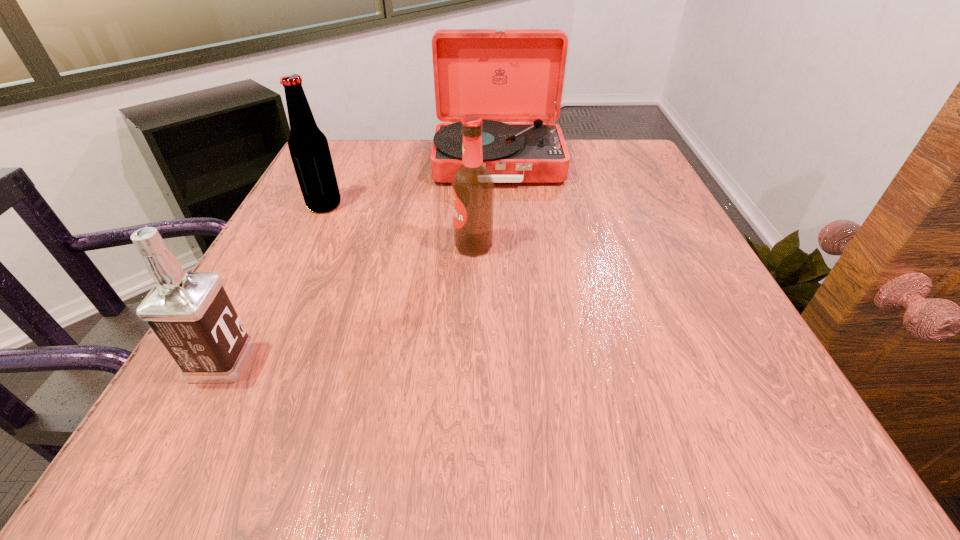
Locate an element on the screen. This screenshot has height=540, width=960. vacant point located between the third nearest object and the nearest object is located at coordinates (273, 284).

You are a GUI agent. You are given a task and a screenshot of the screen. Output one action in this format:
    pyautogui.click(x=<x>, y=<y>)
    Task: Click on the vacant area between the third nearest object and the farthest object
    This screenshot has width=960, height=540.
    Given the screenshot: What is the action you would take?
    pyautogui.click(x=411, y=184)

Locate an element on the screen. This screenshot has height=540, width=960. free point between the left beer bottle and the second nearest object is located at coordinates (399, 226).

This screenshot has width=960, height=540. What are the coordinates of `unoccupied area between the third nearest object and the farthest object` in the screenshot? It's located at (411, 184).

Find the location of a particular element. free space between the nearest object and the right beer bottle is located at coordinates (348, 304).

Where is `unoccupied area between the phonograph_record and the farther beer bottle`? unoccupied area between the phonograph_record and the farther beer bottle is located at coordinates (411, 184).

Locate an element on the screen. Image resolution: width=960 pixels, height=540 pixels. vacant space that is in between the vodka and the phonograph_record is located at coordinates pos(360,262).

Where is `empty space that is in between the second farthest object and the farthest object`? empty space that is in between the second farthest object and the farthest object is located at coordinates (411, 184).

At what (x,y) coordinates should I click in order to perform the action: click on free space between the farthest object and the left beer bottle. Please return your answer as a coordinate pair (x, y). The image size is (960, 540). Looking at the image, I should click on (411, 184).

What are the coordinates of `free space between the vodka and the right beer bottle` in the screenshot? It's located at (348, 304).